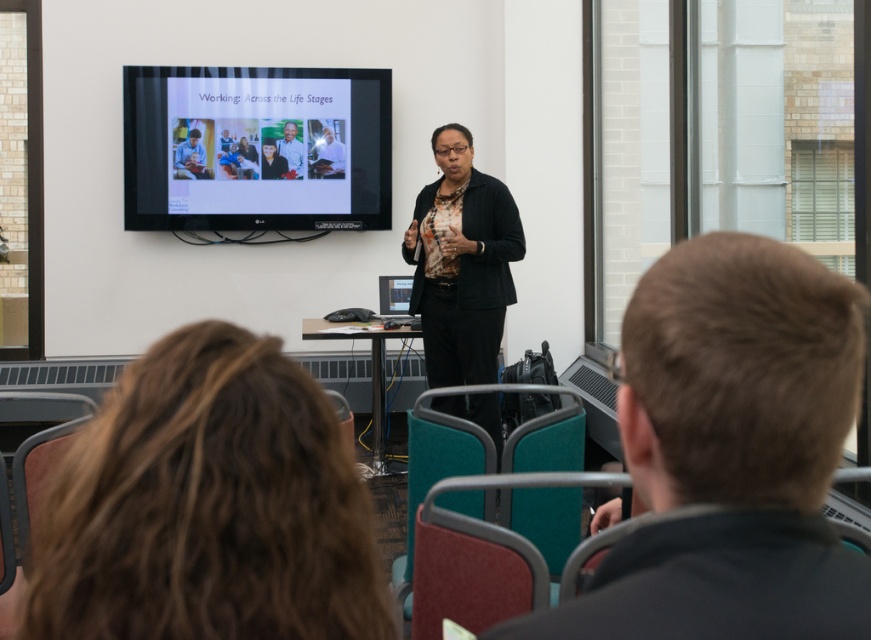
Question: Can you confirm if dark brown hair at center is smaller than light brown wood frame at center?

Choices:
 (A) yes
 (B) no

Answer: (B)

Question: Is matte black laptop at upper left behind light brown wood frame at center?

Choices:
 (A) yes
 (B) no

Answer: (B)

Question: Which point appears closest to the camera in this image?

Choices:
 (A) (231, 368)
 (B) (318, 172)
 (C) (267, 102)
 (D) (262, 166)

Answer: (A)

Question: Which of the following is the closest to the observer?

Choices:
 (A) white glossy shirt at center
 (B) matte black screen at upper center

Answer: (B)

Question: Can you confirm if dark brown hair at center is positioned above green fabric shirt at center?

Choices:
 (A) yes
 (B) no

Answer: (B)

Question: Which point appears farthest from the camera in this image?

Choices:
 (A) (187, 634)
 (B) (206, 177)
 (C) (267, 170)
 (D) (171, 182)

Answer: (C)